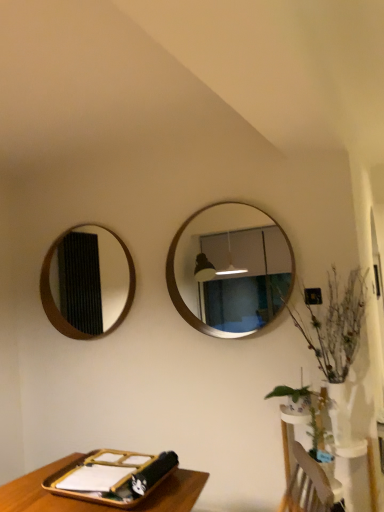
At what (x,y) coordinates should I click in order to perform the action: click on wooden mirror at left, acting as the second mirror starting from the front. Please return your answer as a coordinate pair (x, y). Looking at the image, I should click on (87, 281).

Describe the element at coordinates (304, 472) in the screenshot. The image size is (384, 512). I see `white glossy vase at lower right` at that location.

What do you see at coordinates (336, 326) in the screenshot?
I see `green leafy plant at right` at bounding box center [336, 326].

Measure the distance between point (317,431) and camera.

2.18 meters.

At what (x,y) coordinates should I click in order to perform the action: click on wooden framed mirror at center, placed as the 2th mirror when sorted from left to right. Please return your answer as a coordinate pair (x, y). The height and width of the screenshot is (512, 384). Looking at the image, I should click on (230, 269).

The height and width of the screenshot is (512, 384). What are the coordinates of `wooden mirror at left, acting as the second mirror starting from the front` in the screenshot? It's located at (87, 281).

Considering the relative sizes of white glossy vase at lower right and wooden framed mirror at center, placed as the 2th mirror when sorted from left to right, in the image provided, is white glossy vase at lower right smaller than wooden framed mirror at center, placed as the 2th mirror when sorted from left to right,?

No, white glossy vase at lower right is not smaller than wooden framed mirror at center, placed as the 2th mirror when sorted from left to right.

Is wooden framed mirror at center, placed as the 2th mirror when sorted from left to right, located within white glossy vase at lower right?

No, wooden framed mirror at center, placed as the 2th mirror when sorted from left to right, is not inside white glossy vase at lower right.

Does white glossy vase at lower right appear on the left side of wooden framed mirror at center, arranged as the first mirror when viewed from the front?

No.

From the image's perspective, which object appears higher, white glossy vase at lower right or wooden framed mirror at center, the second mirror viewed from the back?

wooden framed mirror at center, the second mirror viewed from the back, is shown above in the image.

From the picture: From a real-world perspective, is white glossy vase at lower right positioned under green matte plant at lower right based on gravity?

Yes, from a real-world perspective, white glossy vase at lower right is beneath green matte plant at lower right.

Is white glossy vase at lower right far from green matte plant at lower right?

No, there isn't a large distance between white glossy vase at lower right and green matte plant at lower right.

Is white glossy vase at lower right bigger than green matte plant at lower right?

Yes.

Is white glossy vase at lower right facing away from green matte plant at lower right?

Result: No, white glossy vase at lower right is not facing the opposite direction of green matte plant at lower right.

Can you confirm if white glossy vase at lower right is bigger than wooden tray at lower left?

Yes, white glossy vase at lower right is bigger than wooden tray at lower left.

How distant is white glossy vase at lower right from wooden tray at lower left?

white glossy vase at lower right and wooden tray at lower left are 38.12 inches apart.

Is wooden tray at lower left at the back of white glossy vase at lower right?

No, white glossy vase at lower right is not facing the opposite direction of wooden tray at lower left.

Does white glossy vase at lower right lie in front of wooden tray at lower left?

No, white glossy vase at lower right is further to the viewer.

Is point (53, 301) positioned in front of point (308, 304)?

No, (53, 301) is behind (308, 304).

From a real-world perspective, is wooden mirror at left, which is the 1th mirror in left-to-right order, below green leafy plant at right?

Actually, wooden mirror at left, which is the 1th mirror in left-to-right order, is physically above green leafy plant at right in the real world.

Which object is positioned more to the right, wooden mirror at left, which is the 1th mirror in left-to-right order, or green leafy plant at right?

Positioned to the right is green leafy plant at right.

Can you confirm if wooden mirror at left, the second mirror in the right-to-left sequence, is shorter than green leafy plant at right?

Yes.

From the picture: Considering the relative sizes of wooden framed mirror at center, the second mirror viewed from the back, and white glossy vase at lower right in the image provided, is wooden framed mirror at center, the second mirror viewed from the back, bigger than white glossy vase at lower right?

Incorrect, wooden framed mirror at center, the second mirror viewed from the back, is not larger than white glossy vase at lower right.

Considering the relative positions of wooden framed mirror at center, placed as the 2th mirror when sorted from left to right, and white glossy vase at lower right in the image provided, is wooden framed mirror at center, placed as the 2th mirror when sorted from left to right, to the left of white glossy vase at lower right from the viewer's perspective?

Indeed, wooden framed mirror at center, placed as the 2th mirror when sorted from left to right, is positioned on the left side of white glossy vase at lower right.

Can you tell me how much wooden framed mirror at center, arranged as the first mirror when viewed from the front, and white glossy vase at lower right differ in facing direction?

There is a 0.00734-degree angle between the facing directions of wooden framed mirror at center, arranged as the first mirror when viewed from the front, and white glossy vase at lower right.

Considering the sizes of objects wooden framed mirror at center, placed as the 1th mirror when sorted from right to left, and white glossy vase at lower right in the image provided, who is taller, wooden framed mirror at center, placed as the 1th mirror when sorted from right to left, or white glossy vase at lower right?

Standing taller between the two is wooden framed mirror at center, placed as the 1th mirror when sorted from right to left.

Is wooden tray at lower left in contact with wooden framed mirror at center, placed as the 2th mirror when sorted from left to right?

wooden tray at lower left is not next to wooden framed mirror at center, placed as the 2th mirror when sorted from left to right, and they're not touching.

From a real-world perspective, is wooden tray at lower left located higher than wooden framed mirror at center, placed as the 1th mirror when sorted from right to left?

No.

Is the depth of wooden tray at lower left less than that of wooden framed mirror at center, arranged as the first mirror when viewed from the front?

Yes, it is in front of wooden framed mirror at center, arranged as the first mirror when viewed from the front.

Consider the image. Between wooden tray at lower left and wooden framed mirror at center, the second mirror viewed from the back, which one has more height?

wooden framed mirror at center, the second mirror viewed from the back, is taller.

Does white glossy vase at lower right appear on the right side of wooden mirror at left, which is the 1th mirror in left-to-right order?

Yes, white glossy vase at lower right is to the right of wooden mirror at left, which is the 1th mirror in left-to-right order.

From the white glossy vase at lower right, count the 2nd mirror to the left and point to it. Please provide its 2D coordinates.

[(87, 281)]

From a real-world perspective, is white glossy vase at lower right physically below wooden mirror at left, the first mirror in the back-to-front sequence?

Yes, from a real-world perspective, white glossy vase at lower right is beneath wooden mirror at left, the first mirror in the back-to-front sequence.

How distant is white glossy vase at lower right from wooden mirror at left, acting as the second mirror starting from the front?

A distance of 7.65 feet exists between white glossy vase at lower right and wooden mirror at left, acting as the second mirror starting from the front.

Locate an element on the screen. vanity below the wooden framed mirror at center, the second mirror viewed from the back (from a real-world perspective) is located at coordinates (304, 472).

In the image, there is a white glossy vase at lower right. Identify the location of plant above it (from the image's perspective). (298, 394).

When comparing their distances from white glossy vase at lower right, does wooden tray at lower left or green leafy plant at right seem closer?

green leafy plant at right is closer to white glossy vase at lower right.

When comparing their distances from wooden framed mirror at center, placed as the 1th mirror when sorted from right to left, does green matte plant at lower right or wooden mirror at left, the first mirror in the back-to-front sequence, seem closer?

green matte plant at lower right is closer to wooden framed mirror at center, placed as the 1th mirror when sorted from right to left.

Looking at the image, which one is located closer to wooden mirror at left, the second mirror in the right-to-left sequence, white glossy vase at lower right or green leafy plant at right?

green leafy plant at right is closer to wooden mirror at left, the second mirror in the right-to-left sequence.

Which object lies nearer to the anchor point green matte plant at lower right, wooden tray at lower left or green leafy plant at right?

Based on the image, green leafy plant at right appears to be nearer to green matte plant at lower right.

When comparing their distances from green matte plant at lower right, does wooden framed mirror at center, placed as the 1th mirror when sorted from right to left, or wooden tray at lower left seem further?

Among the two, wooden tray at lower left is located further to green matte plant at lower right.

Based on their spatial positions, is green matte plant at lower right or white glossy vase at lower right further from wooden tray at lower left?

Based on the image, green matte plant at lower right appears to be further to wooden tray at lower left.

Considering their positions, is wooden framed mirror at center, placed as the 1th mirror when sorted from right to left, positioned closer to green leafy plant at right than green matte plant at lower right?

green matte plant at lower right lies closer to green leafy plant at right than the other object.

From the image, which object appears to be farther from wooden mirror at left, the first mirror in the back-to-front sequence, green leafy plant at right or white glossy vase at lower right?

white glossy vase at lower right.

Locate an element on the screen. mirror located between wooden mirror at left, which is the 1th mirror in left-to-right order, and green matte plant at lower right in the left-right direction is located at coordinates coord(230,269).

Where is `plant between wooden tray at lower left and green leafy plant at right from left to right`? plant between wooden tray at lower left and green leafy plant at right from left to right is located at coordinates (298, 394).

The width and height of the screenshot is (384, 512). Find the location of `floral arrangement between wooden framed mirror at center, the second mirror viewed from the back, and white glossy vase at lower right vertically`. floral arrangement between wooden framed mirror at center, the second mirror viewed from the back, and white glossy vase at lower right vertically is located at coordinates (336, 326).

This screenshot has width=384, height=512. I want to click on plant between wooden framed mirror at center, placed as the 1th mirror when sorted from right to left, and white glossy vase at lower right in the up-down direction, so click(x=298, y=394).